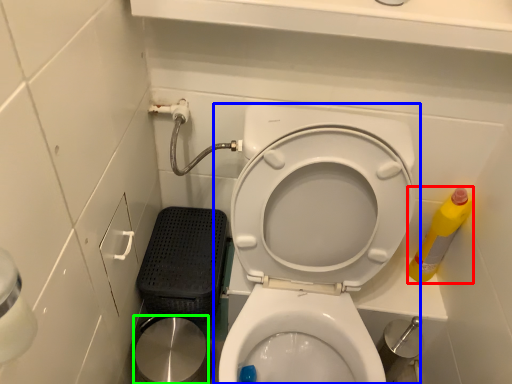
Question: Based on their relative distances, which object is farther from cleaning product (highlighted by a red box)? Choose from toilet (highlighted by a blue box) and potty (highlighted by a green box).

Choices:
 (A) toilet
 (B) potty

Answer: (B)